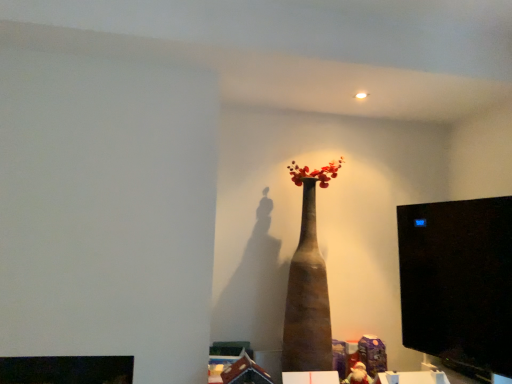
Find the location of a particular element. brown matte vase at center is located at coordinates (307, 298).

What do you see at coordinates (307, 298) in the screenshot? The width and height of the screenshot is (512, 384). I see `brown matte vase at center` at bounding box center [307, 298].

In order to face black glossy monitor at right, should I rotate leftwards or rightwards?

Rotate your view right by about 24.414°.

What do you see at coordinates (458, 283) in the screenshot?
I see `black glossy monitor at right` at bounding box center [458, 283].

In order to click on black glossy monitor at right in this screenshot , I will do `click(458, 283)`.

Find the location of a particular element. brown matte vase at center is located at coordinates (307, 298).

Is black glossy monitor at right to the left of brown matte vase at center from the viewer's perspective?

No, black glossy monitor at right is not to the left of brown matte vase at center.

Is black glossy monitor at right in front of or behind brown matte vase at center in the image?

black glossy monitor at right is positioned closer to the viewer than brown matte vase at center.

Does point (471, 343) lie behind point (294, 310)?

Yes, point (471, 343) is farther from viewer.

From the image's perspective, is black glossy monitor at right located above or below brown matte vase at center?

black glossy monitor at right is above brown matte vase at center.

From a real-world perspective, does black glossy monitor at right sit lower than brown matte vase at center?

Correct, in the physical world, black glossy monitor at right is lower than brown matte vase at center.

Looking at their sizes, would you say black glossy monitor at right is wider or thinner than brown matte vase at center?

Considering their sizes, black glossy monitor at right looks slimmer than brown matte vase at center.

Who is shorter, black glossy monitor at right or brown matte vase at center?

Standing shorter between the two is black glossy monitor at right.

Considering the relative sizes of black glossy monitor at right and brown matte vase at center in the image provided, is black glossy monitor at right smaller than brown matte vase at center?

Correct, black glossy monitor at right occupies less space than brown matte vase at center.

Is black glossy monitor at right located outside brown matte vase at center?

Indeed, black glossy monitor at right is completely outside brown matte vase at center.

Is black glossy monitor at right far from brown matte vase at center?

Actually, black glossy monitor at right and brown matte vase at center are a little close together.

Is black glossy monitor at right oriented towards brown matte vase at center?

No, black glossy monitor at right is not oriented towards brown matte vase at center.

In order to click on computer monitor lying above the brown matte vase at center (from the image's perspective) in this screenshot , I will do `click(458, 283)`.

Does brown matte vase at center appear on the right side of black glossy monitor at right?

Incorrect, brown matte vase at center is not on the right side of black glossy monitor at right.

Considering the relative positions of brown matte vase at center and black glossy monitor at right in the image provided, is brown matte vase at center in front of black glossy monitor at right?

No, the depth of brown matte vase at center is greater than that of black glossy monitor at right.

Which point is more distant from viewer, (x=313, y=277) or (x=499, y=329)?

The point (x=499, y=329) is farther.

From the image's perspective, which is below, brown matte vase at center or black glossy monitor at right?

brown matte vase at center, from the image's perspective.

From a real-world perspective, is brown matte vase at center physically located above or below black glossy monitor at right?

From a real-world perspective, brown matte vase at center is physically above black glossy monitor at right.

Can you confirm if brown matte vase at center is thinner than black glossy monitor at right?

No, brown matte vase at center is not thinner than black glossy monitor at right.

Between brown matte vase at center and black glossy monitor at right, which one has less height?

black glossy monitor at right is shorter.

Who is bigger, brown matte vase at center or black glossy monitor at right?

brown matte vase at center.

Is brown matte vase at center inside or outside of black glossy monitor at right?

brown matte vase at center is not enclosed by black glossy monitor at right.

Can you see brown matte vase at center touching black glossy monitor at right?

No, brown matte vase at center is not beside black glossy monitor at right.

Could you tell me if brown matte vase at center is turned towards black glossy monitor at right?

No, brown matte vase at center is not oriented towards black glossy monitor at right.

Locate an element on the screen. Image resolution: width=512 pixels, height=384 pixels. vase that is above the black glossy monitor at right (from a real-world perspective) is located at coordinates (307, 298).

Identify the location of computer monitor in front of the brown matte vase at center. (458, 283).

Where is `computer monitor above the brown matte vase at center (from the image's perspective)`? This screenshot has width=512, height=384. computer monitor above the brown matte vase at center (from the image's perspective) is located at coordinates (458, 283).